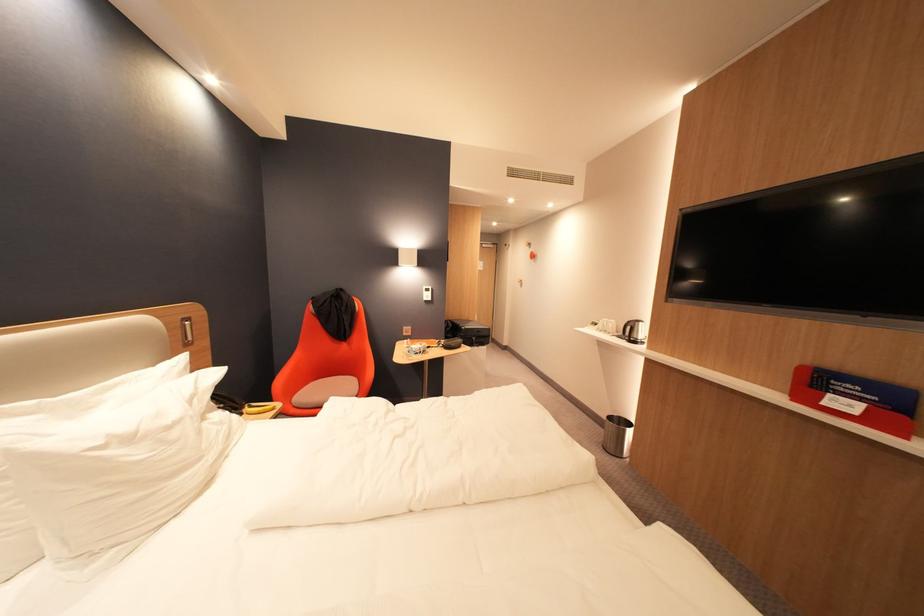
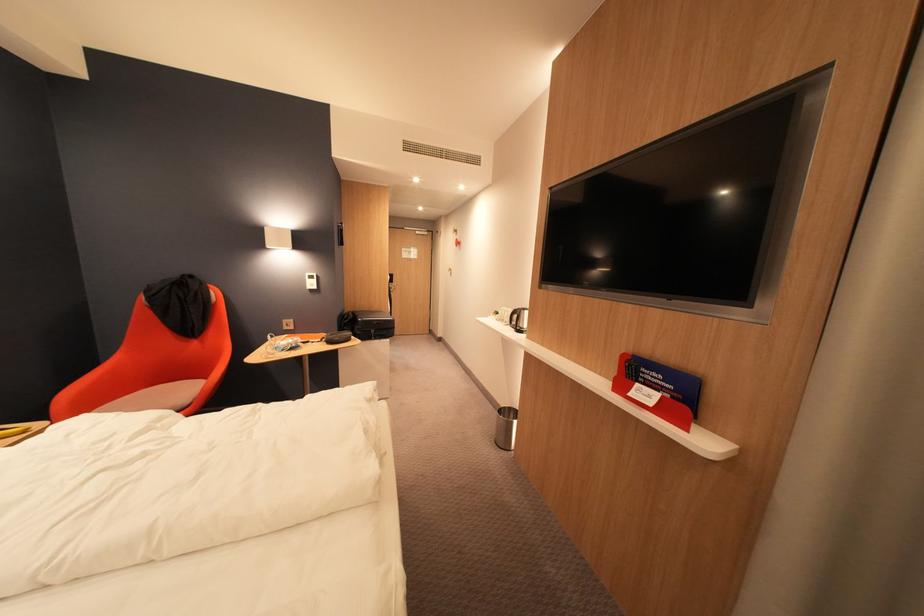
In the second image, find the point that corresponds to the point at 472,330 in the first image.

(370, 321)